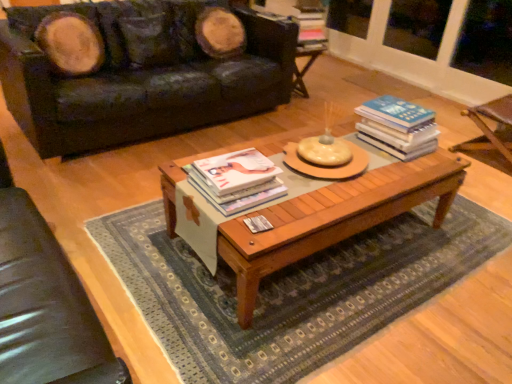
This screenshot has height=384, width=512. What are the coordinates of `free space above wooden coffee table at center (from a real-world perspective)` in the screenshot? It's located at (326, 168).